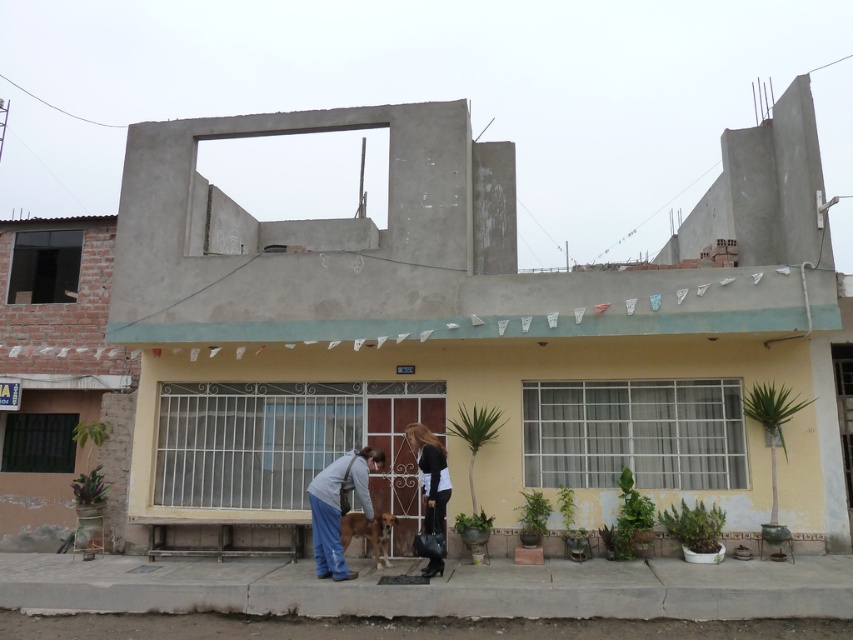
This screenshot has width=853, height=640. I want to click on blue jeans at center, so click(338, 506).

Between blue jeans at center and dark brown hair at center, which one is positioned lower?

Positioned lower is blue jeans at center.

Locate an element on the screen. The height and width of the screenshot is (640, 853). blue jeans at center is located at coordinates (338, 506).

Find the location of a particular element. Image resolution: width=853 pixels, height=640 pixels. blue jeans at center is located at coordinates point(338,506).

Can you confirm if blue jeans at center is smaller than brown fur dog at center?

Incorrect, blue jeans at center is not smaller in size than brown fur dog at center.

Does point (312, 500) come in front of point (372, 547)?

Yes, point (312, 500) is closer to viewer.

Which is behind, point (352, 576) or point (376, 554)?

The point (376, 554) is more distant.

The width and height of the screenshot is (853, 640). In order to click on blue jeans at center in this screenshot , I will do `click(338, 506)`.

Who is positioned more to the left, dark brown hair at center or brown fur dog at center?

brown fur dog at center is more to the left.

Between point (445, 451) and point (390, 516), which one is positioned behind?

Point (445, 451)

You are a GUI agent. You are given a task and a screenshot of the screen. Output one action in this format:
    pyautogui.click(x=<x>, y=<y>)
    Task: Click on the dark brown hair at center
    The image size is (853, 640).
    Given the screenshot: What is the action you would take?
    pyautogui.click(x=430, y=474)